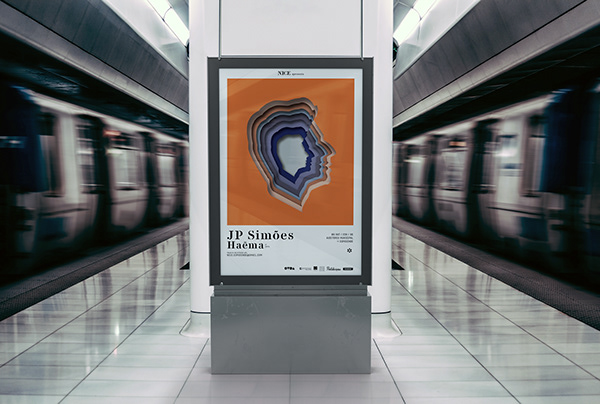
This screenshot has height=404, width=600. What are the coordinates of `ceiling light` in the screenshot? It's located at (170, 19).